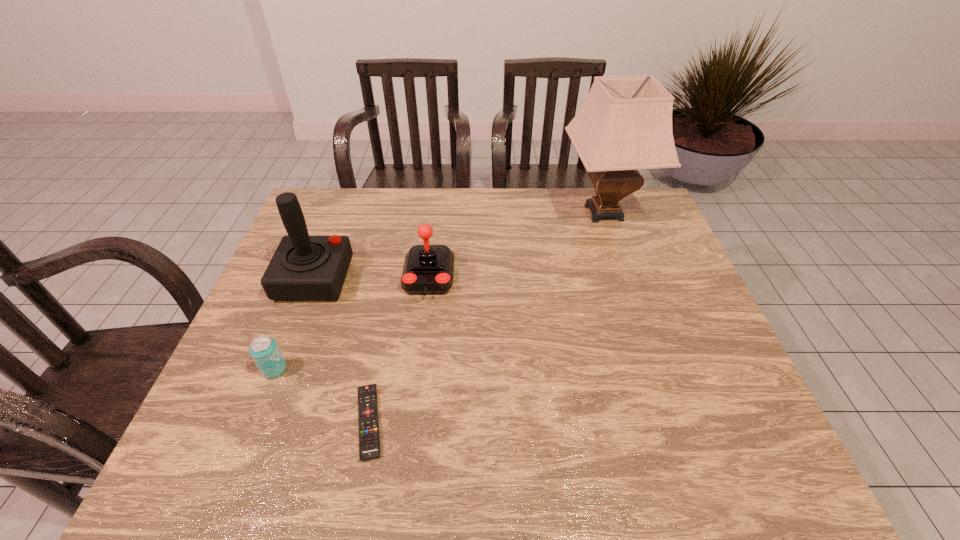
Identify the location of the rightmost object. This screenshot has width=960, height=540. (625, 124).

In order to click on the farthest object in this screenshot , I will do `click(625, 124)`.

Where is `the taller joystick`? the taller joystick is located at coordinates (303, 268).

In order to click on the second tallest object in this screenshot , I will do point(303,268).

At what (x,y) coordinates should I click in order to perform the action: click on the shorter joystick. Please return your answer as a coordinate pair (x, y). Looking at the image, I should click on (428, 269).

The width and height of the screenshot is (960, 540). I want to click on the right joystick, so click(x=428, y=269).

You are a GUI agent. You are given a task and a screenshot of the screen. Output one action in this format:
    pyautogui.click(x=<x>, y=<y>)
    Task: Click on the beer can
    This screenshot has height=540, width=960.
    Given the screenshot: What is the action you would take?
    pyautogui.click(x=263, y=349)

Locate an element on the screen. The height and width of the screenshot is (540, 960). the fourth farthest object is located at coordinates (263, 349).

In order to click on the nearest object in this screenshot , I will do (369, 439).

Image resolution: width=960 pixels, height=540 pixels. Find the location of `the shortest object`. the shortest object is located at coordinates click(369, 439).